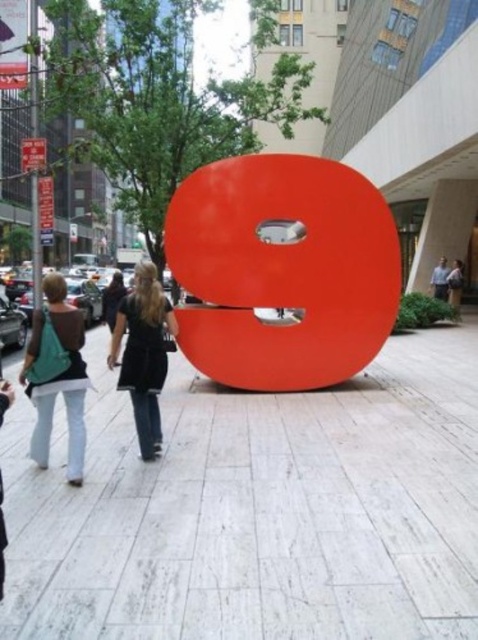
Between matte orange sculpture at center and matte teal bag at left, which one has less height?

matte teal bag at left is shorter.

Which is behind, point (330, 362) or point (35, 451)?

The point (330, 362) is behind.

Locate an element on the screen. matte orange sculpture at center is located at coordinates (282, 269).

Is black matte dress at center shorter than matte teal bag at left?

Yes, black matte dress at center is shorter than matte teal bag at left.

Can you confirm if black matte dress at center is bigger than matte teal bag at left?

Actually, black matte dress at center might be smaller than matte teal bag at left.

Which is in front, point (154, 280) or point (44, 444)?

Point (44, 444) is more forward.

Identify the location of black matte dress at center. (143, 353).

Which is in front, point (339, 355) or point (163, 312)?

Point (163, 312)

This screenshot has height=640, width=478. Identify the location of matte orange sculpture at center. (282, 269).

Consider the image. Who is more forward, (201,348) or (142,323)?

Point (142,323) is more forward.

Find the location of a particular element. matte orange sculpture at center is located at coordinates (282, 269).